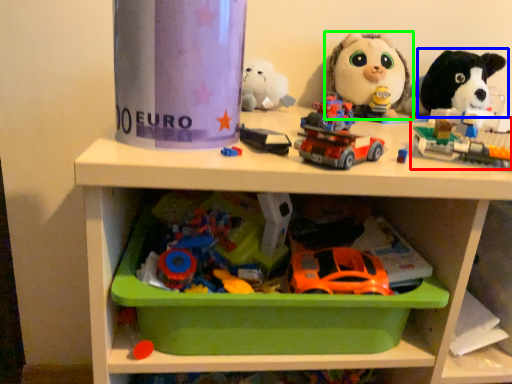
Question: Estimate the real-world distances between objects in this image. Which object is farther from toy (highlighted by a red box), toy (highlighted by a blue box) or toy (highlighted by a green box)?

Choices:
 (A) toy
 (B) toy

Answer: (B)